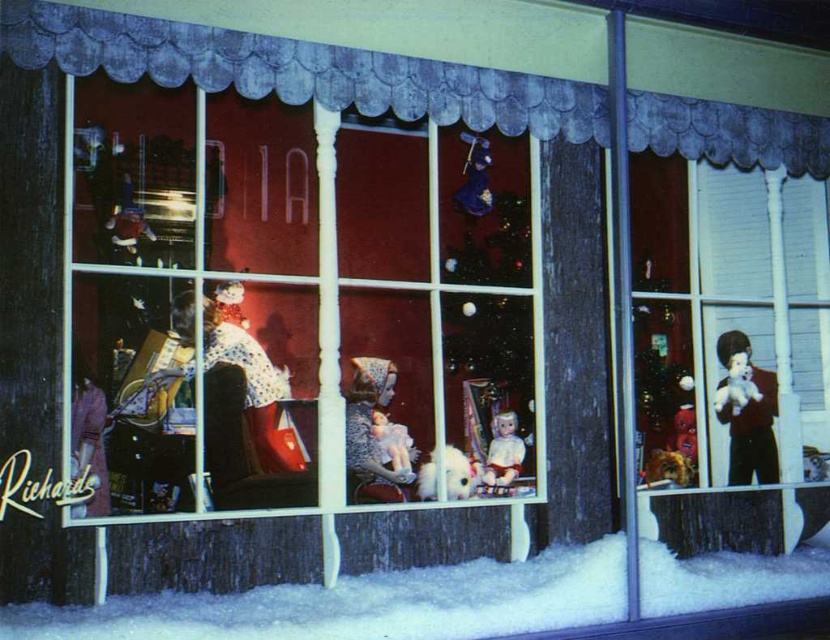
You are a window cleaner standing at the lower edge of the window display. You need to clean the velvet blue curtain at upper center. Which direction should you move to reach it?

The velvet blue curtain at upper center is located at point (x=299, y=70), so you should move upward to reach it.

You are a store employee who needs to place a new toy on the shelf. The shelf has limited space. Which doll, the white plush doll at center or the matte porcelain doll at center, would you choose to place on the shelf if you want to maximize the number of toys you can fit?

The white plush doll at center occupies less space than the matte porcelain doll at center, so placing the white plush doll at center would allow more toys to fit on the shelf.

You are a delivery robot that is 50 centimeters wide. You need to place a package between the velvet blue curtain at upper center and the white plush dog at center in the toy store window display. Can you fit through the space between them?

The distance between the velvet blue curtain at upper center and the white plush dog at center is 94.14 centimeters. Since the robot is 50 centimeters wide, it can fit through the space as the distance is wider than the robot.